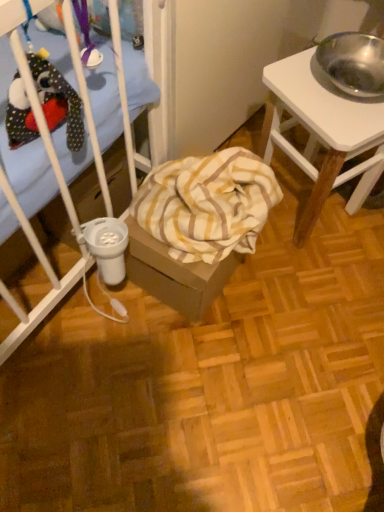
The width and height of the screenshot is (384, 512). Identify the location of yellow striped fabric at center. (207, 204).

What do you see at coordinates (207, 204) in the screenshot?
I see `yellow striped fabric at center` at bounding box center [207, 204].

The width and height of the screenshot is (384, 512). What are the coordinates of `white wood desk at right` in the screenshot? It's located at tap(322, 132).

The width and height of the screenshot is (384, 512). Describe the element at coordinates (322, 132) in the screenshot. I see `white wood desk at right` at that location.

Identify the location of yellow striped fabric at center. (207, 204).

Which is more to the left, yellow striped fabric at center or white wood desk at right?

From the viewer's perspective, yellow striped fabric at center appears more on the left side.

Is yellow striped fabric at center closer to camera compared to white wood desk at right?

No, it is not.

Which is in front, point (163, 194) or point (380, 146)?

The point (163, 194) is closer to the camera.

From the image's perspective, does yellow striped fabric at center appear lower than white wood desk at right?

Indeed, from the image's perspective, yellow striped fabric at center is shown beneath white wood desk at right.

From a real-world perspective, between yellow striped fabric at center and white wood desk at right, who is vertically higher?

From a 3D spatial view, white wood desk at right is above.

Considering the relative sizes of yellow striped fabric at center and white wood desk at right in the image provided, is yellow striped fabric at center thinner than white wood desk at right?

Indeed, yellow striped fabric at center has a lesser width compared to white wood desk at right.

Is yellow striped fabric at center taller or shorter than white wood desk at right?

In the image, yellow striped fabric at center appears to be shorter than white wood desk at right.

Based on their sizes in the image, would you say yellow striped fabric at center is bigger or smaller than white wood desk at right?

yellow striped fabric at center is smaller than white wood desk at right.

Would you say white wood desk at right is part of yellow striped fabric at center's contents?

No, white wood desk at right is not a part of yellow striped fabric at center.

Is yellow striped fabric at center not close to white wood desk at right?

No, yellow striped fabric at center is in close proximity to white wood desk at right.

Is yellow striped fabric at center positioned with its back to white wood desk at right?

No, yellow striped fabric at center is not facing the opposite direction of white wood desk at right.

How much distance is there between yellow striped fabric at center and white wood desk at right?

26.11 centimeters.

Locate an element on the screen. The height and width of the screenshot is (512, 384). desk in front of the yellow striped fabric at center is located at coordinates (322, 132).

In the image, is white wood desk at right on the left side or the right side of yellow striped fabric at center?

Based on their positions, white wood desk at right is located to the right of yellow striped fabric at center.

Is white wood desk at right further to camera compared to yellow striped fabric at center?

No, white wood desk at right is closer to the camera.

Does point (283, 105) come farther from viewer compared to point (209, 262)?

That is True.

From the image's perspective, would you say white wood desk at right is shown under yellow striped fabric at center?

No.

From the picture: From a real-world perspective, which is physically above, white wood desk at right or yellow striped fabric at center?

From a 3D spatial view, white wood desk at right is above.

Is white wood desk at right thinner than yellow striped fabric at center?

No, white wood desk at right is not thinner than yellow striped fabric at center.

Between white wood desk at right and yellow striped fabric at center, which one has less height?

Standing shorter between the two is yellow striped fabric at center.

Which of these two, white wood desk at right or yellow striped fabric at center, is smaller?

Smaller between the two is yellow striped fabric at center.

Is white wood desk at right completely or partially outside of yellow striped fabric at center?

white wood desk at right lies outside yellow striped fabric at center's area.

Looking at this image, can you see white wood desk at right touching yellow striped fabric at center?

There is a gap between white wood desk at right and yellow striped fabric at center.

Is white wood desk at right oriented towards yellow striped fabric at center?

No, white wood desk at right is not facing towards yellow striped fabric at center.

Can you tell me how much white wood desk at right and yellow striped fabric at center differ in facing direction?

There is a 27-degree angle between the facing directions of white wood desk at right and yellow striped fabric at center.

How distant is white wood desk at right from yellow striped fabric at center?

white wood desk at right and yellow striped fabric at center are 10.28 inches apart.

This screenshot has width=384, height=512. Find the location of `desk above the yellow striped fabric at center (from the image's perspective)`. desk above the yellow striped fabric at center (from the image's perspective) is located at coordinates (322, 132).

The height and width of the screenshot is (512, 384). What are the coordinates of `blanket that is on the left side of white wood desk at right` in the screenshot? It's located at (207, 204).

Locate an element on the screen. desk above the yellow striped fabric at center (from the image's perspective) is located at coordinates (322, 132).